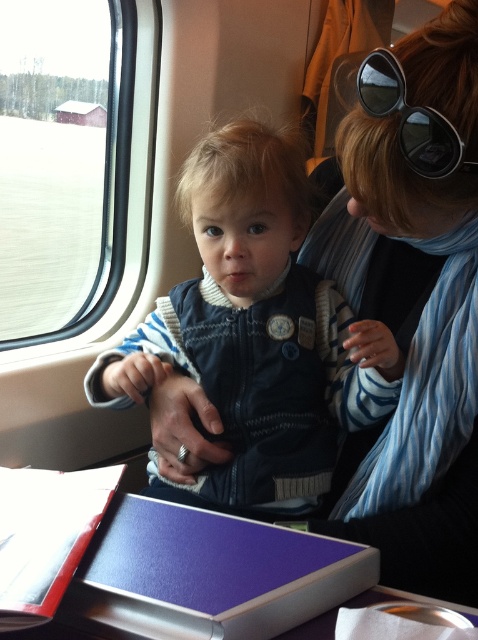
You are standing in the train carriage and want to reach the point marked at coordinates (210, 184). If your arm can extend 30 inches, can you reach it without moving your feet?

The point at coordinates (210, 184) is 32.75 inches away from you, which is beyond your arm reach of 30 inches. You cannot reach it without moving your feet.

You are a passenger in the train carriage and want to see the view outside without removing your sunglasses. Can you look through the transparent glass window at upper left while wearing the black reflective sunglasses at upper right?

Yes, you can look through the transparent glass window at upper left while wearing the black reflective sunglasses at upper right because the window is positioned above the sunglasses, allowing the light to pass through the window and into your eyes while the sunglasses remain on your head.